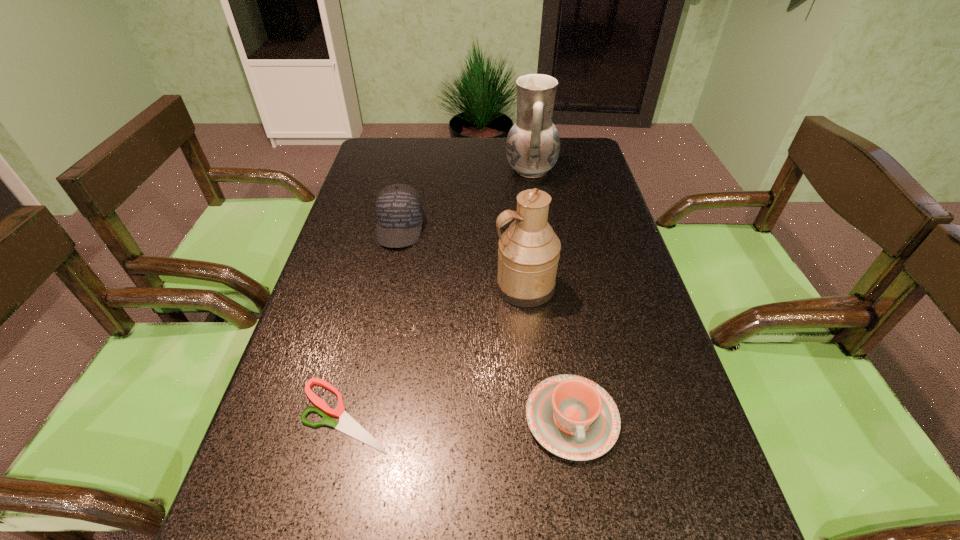
Where is `the farthest object`? This screenshot has height=540, width=960. the farthest object is located at coordinates (533, 145).

The width and height of the screenshot is (960, 540). I want to click on the nearer pitcher, so click(x=529, y=250).

Identify the location of baseball cap. (399, 209).

Where is `the third shortest object`? This screenshot has height=540, width=960. the third shortest object is located at coordinates (399, 209).

Find the location of a particular element. This screenshot has width=960, height=540. chinaware is located at coordinates [x=574, y=418].

You are a GUI agent. You are given a task and a screenshot of the screen. Output one action in this format:
    pyautogui.click(x=<x>, y=<y>)
    Task: Click on the shortest object
    The height and width of the screenshot is (540, 960).
    Given the screenshot: What is the action you would take?
    pyautogui.click(x=346, y=424)

Find the location of `blank space located on the front-facing side of the farthest object`. blank space located on the front-facing side of the farthest object is located at coordinates pos(421,170).

Where is `vacant space located 0.320m on the front-facing side of the farthest object`? vacant space located 0.320m on the front-facing side of the farthest object is located at coordinates (406, 170).

Identify the location of vacant space positioned on the front-facing side of the farthest object. The width and height of the screenshot is (960, 540). (459, 170).

Find the location of a particular element. The image size is (960, 540). free region located on the left of the nearer pitcher is located at coordinates (394, 287).